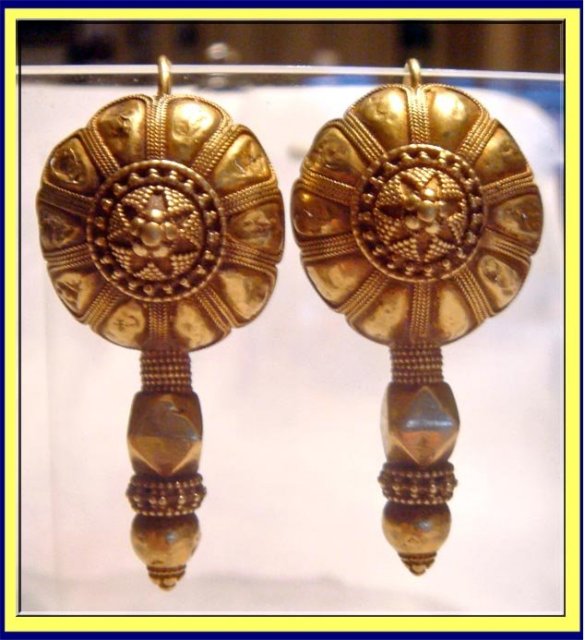
You are a GUI agent. You are given a task and a screenshot of the screen. Output one action in this format:
    pyautogui.click(x=<x>, y=<y>)
    Task: Click on the ring hooks
    The height and width of the screenshot is (640, 585).
    Given the screenshot: What is the action you would take?
    pyautogui.click(x=412, y=70), pyautogui.click(x=154, y=64)